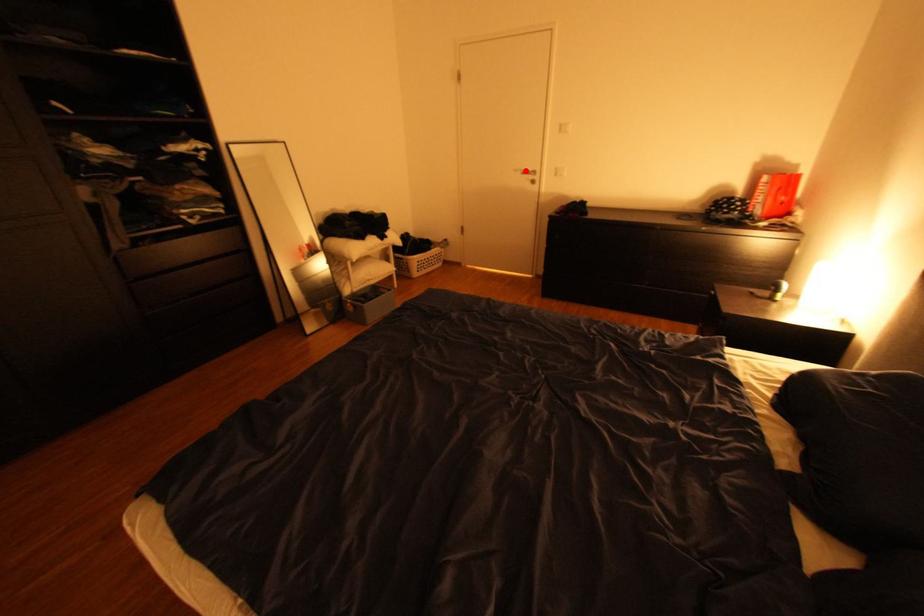
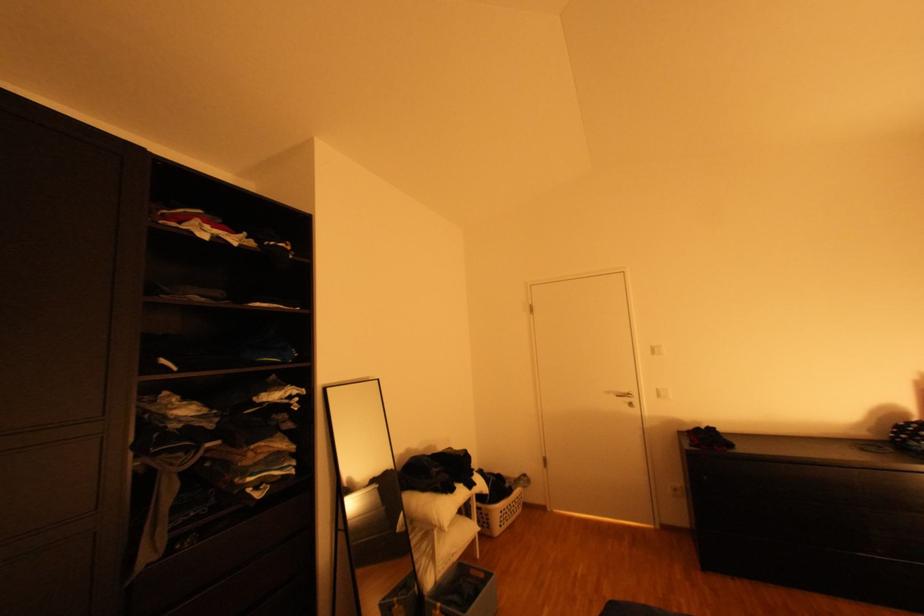
Question: I am providing you with two images of the same scene from different viewpoints. In image1, a red point is highlighted. Considering the same 3D point in image2, which of the following is correct?

Choices:
 (A) It is closer
 (B) It is farther

Answer: (B)